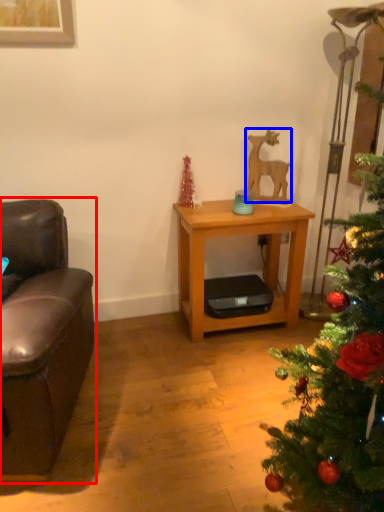
Question: Which of the following is the closest to the observer, studio couch (highlighted by a red box) or animal (highlighted by a blue box)?

Choices:
 (A) studio couch
 (B) animal

Answer: (A)